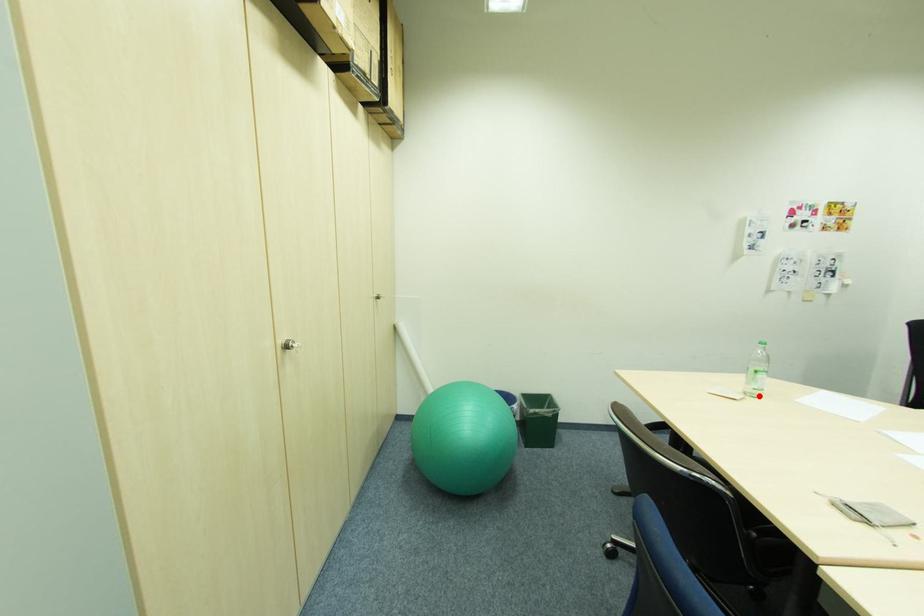
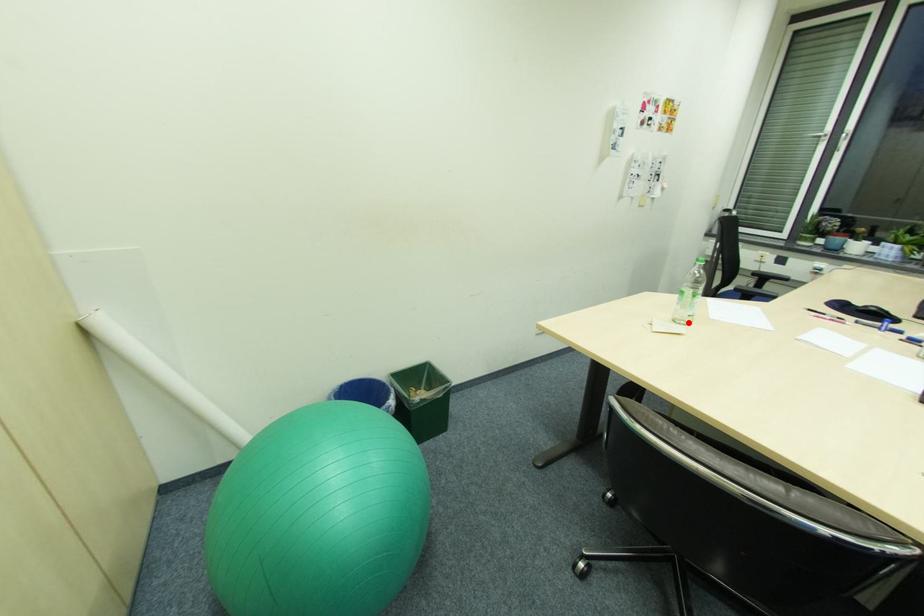
I am providing you with two images of the same scene from different viewpoints. A red point is marked on the first image and another point is marked on the second image. Does the point marked in image1 correspond to the same location as the one in image2?

Yes